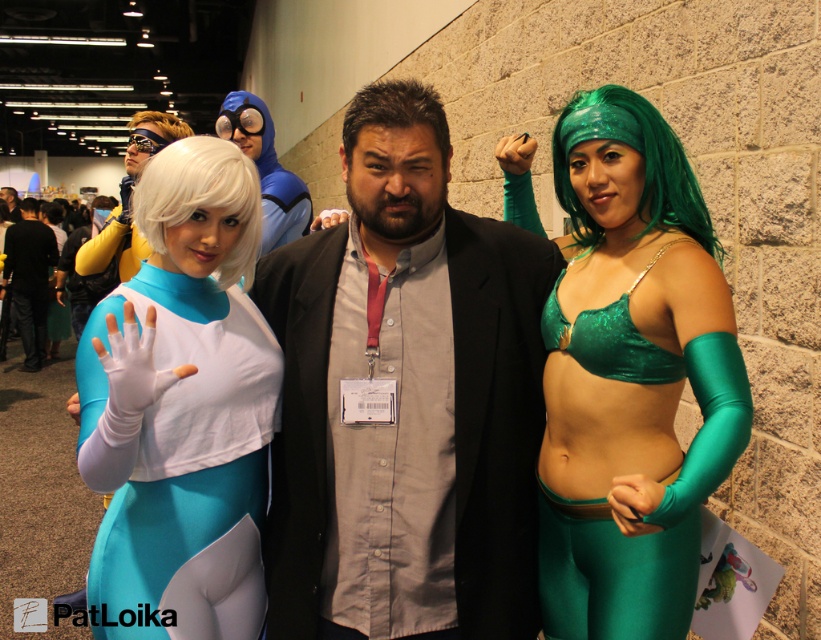
You are a photographer at the event and need to ensure the green velvet bra at center and dark brown hair at center are both visible in your photo. Given that the camera can only focus on objects above a certain height, which object should you prioritize to ensure it is in focus?

The green velvet bra at center is taller than dark brown hair at center, so you should prioritize focusing on the green velvet bra at center to ensure it is in focus.